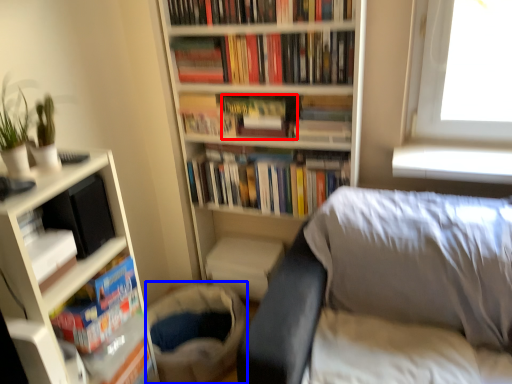
Question: Which point is further to the camera, paperback book (highlighted by a red box) or gray (highlighted by a blue box)?

Choices:
 (A) paperback book
 (B) gray

Answer: (A)